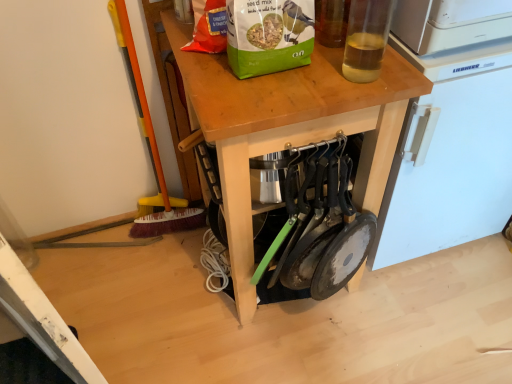
Question: Is white plastic refrigerator at upper right in front of or behind translucent glass bottle at upper right in the image?

Choices:
 (A) front
 (B) behind

Answer: (B)

Question: From a real-world perspective, relative to translucent glass bottle at upper right, is white plastic refrigerator at upper right vertically above or below?

Choices:
 (A) above
 (B) below

Answer: (B)

Question: Based on their relative distances, which object is farther from the green matte paper bag at upper center?

Choices:
 (A) wooden at center
 (B) white plastic refrigerator at upper right
 (C) orange plastic brush at left
 (D) translucent glass bottle at upper right

Answer: (C)

Question: Which object is positioned farthest from the white plastic refrigerator at upper right?

Choices:
 (A) translucent glass bottle at upper right
 (B) wooden at center
 (C) orange plastic brush at left
 (D) green matte paper bag at upper center

Answer: (C)